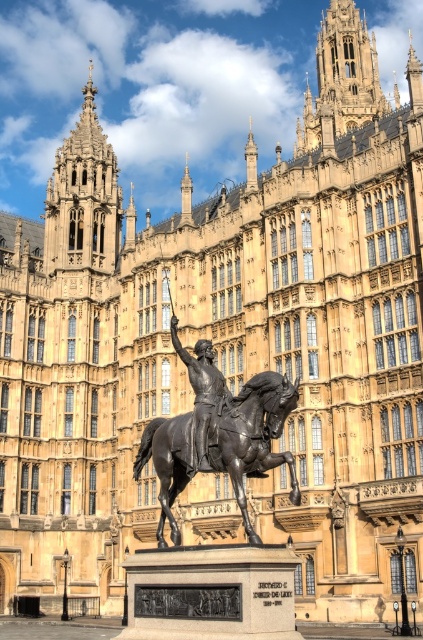
You are an architect examining the building and its surroundings. You notice the bronze textured horse at center and the golden stone tower at upper center. Which object is shorter in height?

The bronze textured horse at center is shorter in height compared to the golden stone tower at upper center.

You are an art student analyzing the positioning of the statues in the image. The scene includes a bronze textured horse at center and a bronze statue at center. Which of these two objects is placed lower in the image?

The bronze textured horse at center is positioned under the bronze statue at center, so it is placed lower in the image.